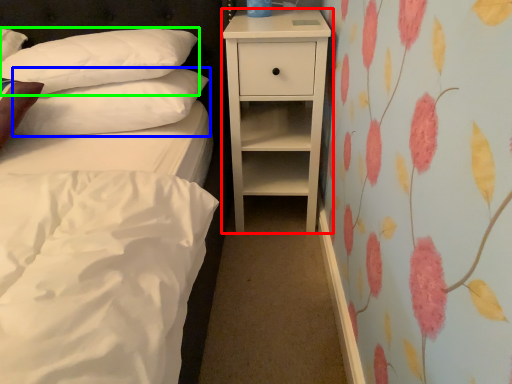
Question: Which is nearer to the nightstand (highlighted by a red box)? pillow (highlighted by a blue box) or pillow (highlighted by a green box).

Choices:
 (A) pillow
 (B) pillow

Answer: (A)